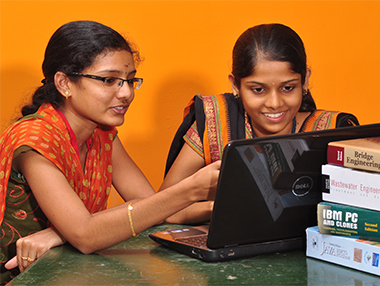
Locate an element on the screen. This screenshot has height=286, width=380. box is located at coordinates (355, 157), (358, 195), (365, 217), (336, 258).